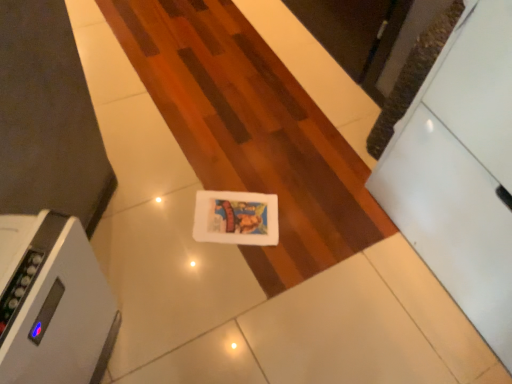
What do you see at coordinates (52, 302) in the screenshot?
I see `gray plastic air purifier at lower left` at bounding box center [52, 302].

Locate an element on the screen. gray plastic air purifier at lower left is located at coordinates (52, 302).

Measure the distance between gray plastic air purifier at lower left and camera.

They are 26.15 inches apart.

Describe the element at coordinates (452, 221) in the screenshot. This screenshot has height=384, width=512. I see `white glossy drawer at right` at that location.

Locate an element on the screen. The height and width of the screenshot is (384, 512). white glossy drawer at right is located at coordinates (452, 221).

Locate an element on the screen. gray plastic air purifier at lower left is located at coordinates pos(52,302).

Is gray plastic air purifier at lower left to the left or to the right of white glossy drawer at right in the image?

gray plastic air purifier at lower left is positioned on white glossy drawer at right's left side.

Which object is closer to the camera, gray plastic air purifier at lower left or white glossy drawer at right?

white glossy drawer at right is in front.

Considering the positions of point (89, 332) and point (408, 200), is point (89, 332) closer or farther from the camera than point (408, 200)?

Point (89, 332) is positioned closer to the camera compared to point (408, 200).

Looking at this image, from the image's perspective, is gray plastic air purifier at lower left located above or below white glossy drawer at right?

gray plastic air purifier at lower left is below white glossy drawer at right.

From a real-world perspective, relative to white glossy drawer at right, is gray plastic air purifier at lower left vertically above or below?

In terms of real-world spatial position, gray plastic air purifier at lower left is below white glossy drawer at right.

Does gray plastic air purifier at lower left have a lesser width compared to white glossy drawer at right?

Correct, the width of gray plastic air purifier at lower left is less than that of white glossy drawer at right.

Between gray plastic air purifier at lower left and white glossy drawer at right, which one has less height?

With less height is gray plastic air purifier at lower left.

Considering the sizes of objects gray plastic air purifier at lower left and white glossy drawer at right in the image provided, who is bigger, gray plastic air purifier at lower left or white glossy drawer at right?

Bigger between the two is white glossy drawer at right.

Is gray plastic air purifier at lower left completely or partially outside of white glossy drawer at right?

gray plastic air purifier at lower left lies outside white glossy drawer at right's area.

Is gray plastic air purifier at lower left with white glossy drawer at right?

No, gray plastic air purifier at lower left is not in contact with white glossy drawer at right.

Is gray plastic air purifier at lower left oriented away from white glossy drawer at right?

No, gray plastic air purifier at lower left is not facing away from white glossy drawer at right.

Can you tell me how much gray plastic air purifier at lower left and white glossy drawer at right differ in facing direction?

The angle between the facing direction of gray plastic air purifier at lower left and the facing direction of white glossy drawer at right is 138 degrees.

Find the location of a particular element. Image resolution: width=512 pixels, height=384 pixels. drawer above the gray plastic air purifier at lower left (from the image's perspective) is located at coordinates (452, 221).

Does white glossy drawer at right appear on the right side of gray plastic air purifier at lower left?

Indeed, white glossy drawer at right is positioned on the right side of gray plastic air purifier at lower left.

Which is behind, white glossy drawer at right or gray plastic air purifier at lower left?

gray plastic air purifier at lower left is more distant.

Is point (419, 179) positioned in front of point (40, 307)?

That is False.

From the image's perspective, is white glossy drawer at right located beneath gray plastic air purifier at lower left?

No, from the image's perspective, white glossy drawer at right is not below gray plastic air purifier at lower left.

From the picture: From a real-world perspective, between white glossy drawer at right and gray plastic air purifier at lower left, who is vertically higher?

white glossy drawer at right is physically above.

Looking at their sizes, would you say white glossy drawer at right is wider or thinner than gray plastic air purifier at lower left?

white glossy drawer at right is wider than gray plastic air purifier at lower left.

Between white glossy drawer at right and gray plastic air purifier at lower left, which one has less height?

Standing shorter between the two is gray plastic air purifier at lower left.

Considering the sizes of objects white glossy drawer at right and gray plastic air purifier at lower left in the image provided, who is smaller, white glossy drawer at right or gray plastic air purifier at lower left?

gray plastic air purifier at lower left.

Choose the correct answer: Is white glossy drawer at right inside gray plastic air purifier at lower left or outside it?

The correct answer is: outside.

Is white glossy drawer at right in contact with gray plastic air purifier at lower left?

white glossy drawer at right and gray plastic air purifier at lower left are not in contact.

Does white glossy drawer at right turn towards gray plastic air purifier at lower left?

Yes, white glossy drawer at right is turned towards gray plastic air purifier at lower left.

How many degrees apart are the facing directions of white glossy drawer at right and gray plastic air purifier at lower left?

138 degrees.

Find the location of a particular element. Image resolution: width=512 pixels, height=384 pixels. home appliance that is below the white glossy drawer at right (from the image's perspective) is located at coordinates (52, 302).

Image resolution: width=512 pixels, height=384 pixels. What are the coordinates of `drawer in front of the gray plastic air purifier at lower left` in the screenshot? It's located at (452, 221).

Find the location of `home appliance on the left of white glossy drawer at right`. home appliance on the left of white glossy drawer at right is located at coordinates (52, 302).